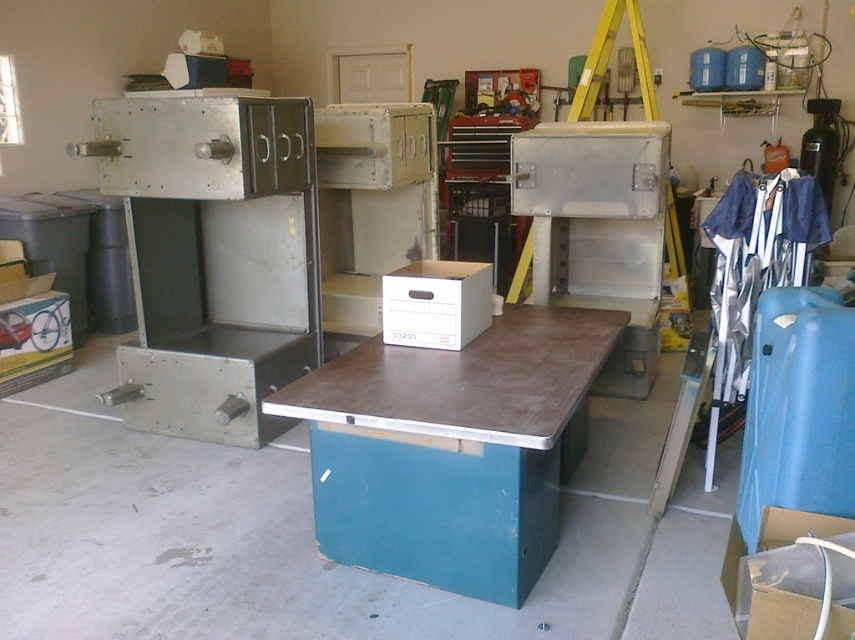
You are organizing the garage and need to move the cardboard box at lower right closer to the wall. The metallic gray machine at left is in the way. Can you move the box around the machine to the right side?

The metallic gray machine at left is to the left of the cardboard box at lower right, so moving the box around the machine to the right side would require going past the machine on its right side, which may be possible depending on the space available.

Please look at the image of the garage. There is a point at coordinates [435,304]. What object is located at that point?

The point at coordinates [435,304] corresponds to the white cardboard box at center.